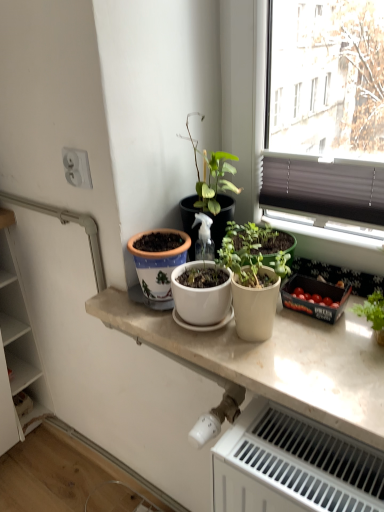
Question: Is matte white pot at center completely or partially outside of white plastic radiator at lower right?

Choices:
 (A) no
 (B) yes

Answer: (B)

Question: Is matte white pot at center oriented away from white plastic radiator at lower right?

Choices:
 (A) no
 (B) yes

Answer: (A)

Question: Can you confirm if matte white pot at center is shorter than white plastic radiator at lower right?

Choices:
 (A) no
 (B) yes

Answer: (B)

Question: Would you say matte white pot at center is a long distance from white plastic radiator at lower right?

Choices:
 (A) no
 (B) yes

Answer: (A)

Question: Does matte white pot at center appear on the right side of white plastic radiator at lower right?

Choices:
 (A) yes
 (B) no

Answer: (B)

Question: In terms of height, does white matte countertop at center look taller or shorter compared to matte white pot at center?

Choices:
 (A) tall
 (B) short

Answer: (B)

Question: From a real-world perspective, is white matte countertop at center above or below matte white pot at center?

Choices:
 (A) below
 (B) above

Answer: (A)

Question: From the image's perspective, is white matte countertop at center above or below matte white pot at center?

Choices:
 (A) above
 (B) below

Answer: (B)

Question: Visually, is white matte countertop at center positioned to the left or to the right of matte white pot at center?

Choices:
 (A) right
 (B) left

Answer: (B)

Question: Do you think white wood cabinet at left is within white matte countertop at center, or outside of it?

Choices:
 (A) inside
 (B) outside

Answer: (B)

Question: From a real-world perspective, is white wood cabinet at left above or below white matte countertop at center?

Choices:
 (A) above
 (B) below

Answer: (B)

Question: Is white wood cabinet at left to the left or to the right of white matte countertop at center in the image?

Choices:
 (A) right
 (B) left

Answer: (B)

Question: Considering the positions of white wood cabinet at left and white matte countertop at center in the image, is white wood cabinet at left wider or thinner than white matte countertop at center?

Choices:
 (A) wide
 (B) thin

Answer: (A)

Question: Looking at the image, does matte white pot at center seem bigger or smaller compared to white ceramic pot at center?

Choices:
 (A) small
 (B) big

Answer: (B)

Question: Looking at their shapes, would you say matte white pot at center is wider or thinner than white ceramic pot at center?

Choices:
 (A) thin
 (B) wide

Answer: (A)